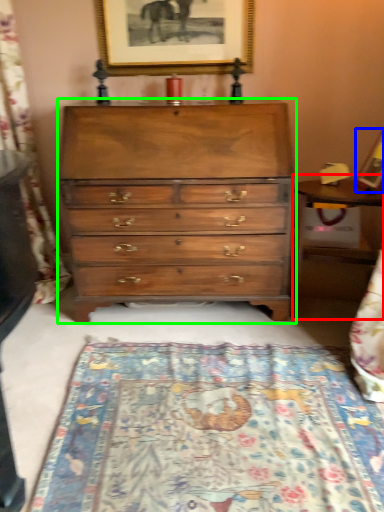
Question: Which is nearer to the table (highlighted by a red box)? picture frame (highlighted by a blue box) or chest of drawers (highlighted by a green box).

Choices:
 (A) picture frame
 (B) chest of drawers

Answer: (A)